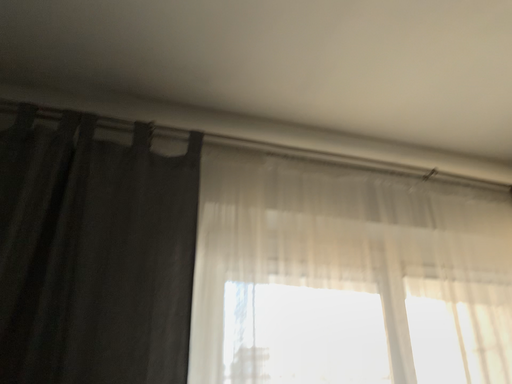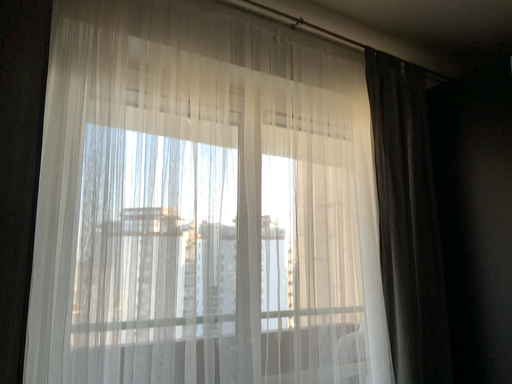
Question: Which way did the camera rotate in the video?

Choices:
 (A) rotated upward
 (B) rotated downward

Answer: (B)